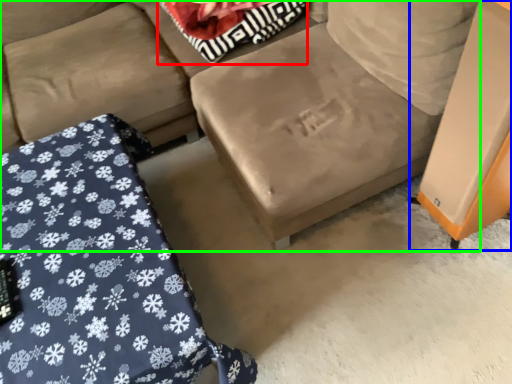
Question: Which object is the farthest from pillow (highlighted by a red box)? Choose among these: table (highlighted by a blue box) or studio couch (highlighted by a green box).

Choices:
 (A) table
 (B) studio couch

Answer: (A)